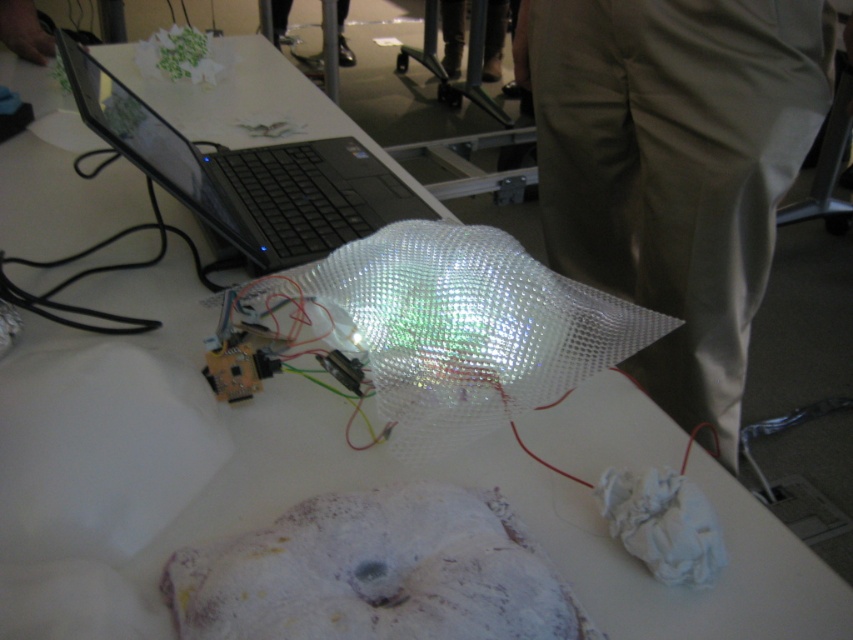
From the picture: Does khaki cotton pants at right appear over black glossy laptop at upper left?

No.

Is khaki cotton pants at right to the left of black glossy laptop at upper left from the viewer's perspective?

Incorrect, khaki cotton pants at right is not on the left side of black glossy laptop at upper left.

Who is more distant from viewer, (732,440) or (318,244)?

Positioned behind is point (732,440).

Identify the location of khaki cotton pants at right. This screenshot has height=640, width=853. (674, 168).